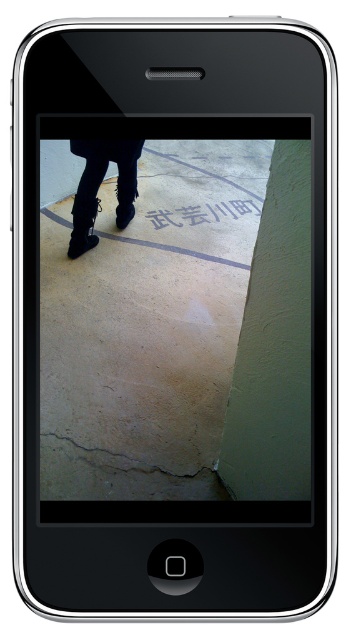
Question: Is black leather boots at lower left positioned at the back of brown rough concrete at lower center?

Choices:
 (A) no
 (B) yes

Answer: (B)

Question: Observing the image, what is the correct spatial positioning of black leather boots at lower left in reference to brown rough concrete at lower center?

Choices:
 (A) above
 (B) below

Answer: (A)

Question: Observing the image, what is the correct spatial positioning of black leather boots at lower left in reference to brown rough concrete at lower center?

Choices:
 (A) left
 (B) right

Answer: (A)

Question: Which point is farther to the camera?

Choices:
 (A) (131, 477)
 (B) (88, 237)

Answer: (B)

Question: Which of the following is the farthest from the observer?

Choices:
 (A) brown rough concrete at lower center
 (B) black leather boots at lower left

Answer: (B)